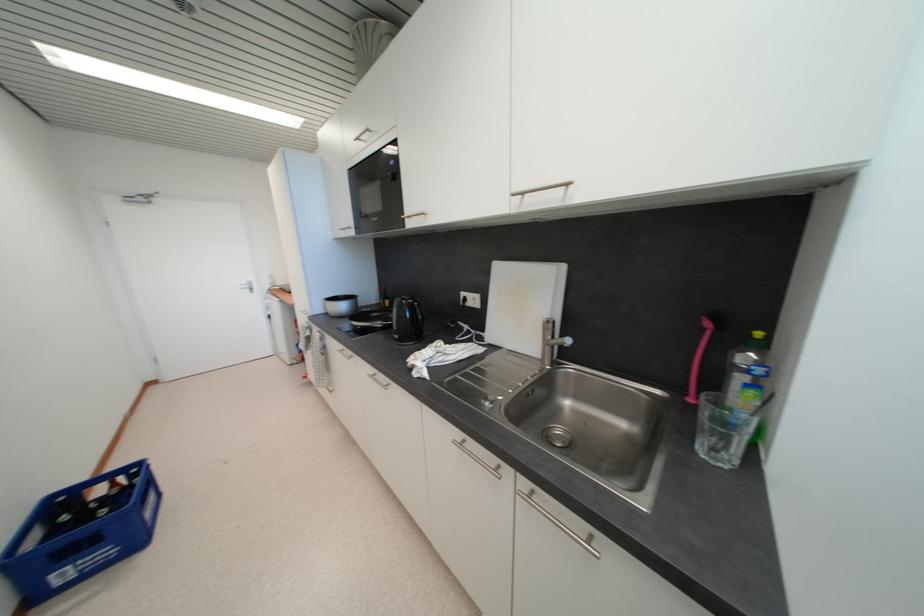
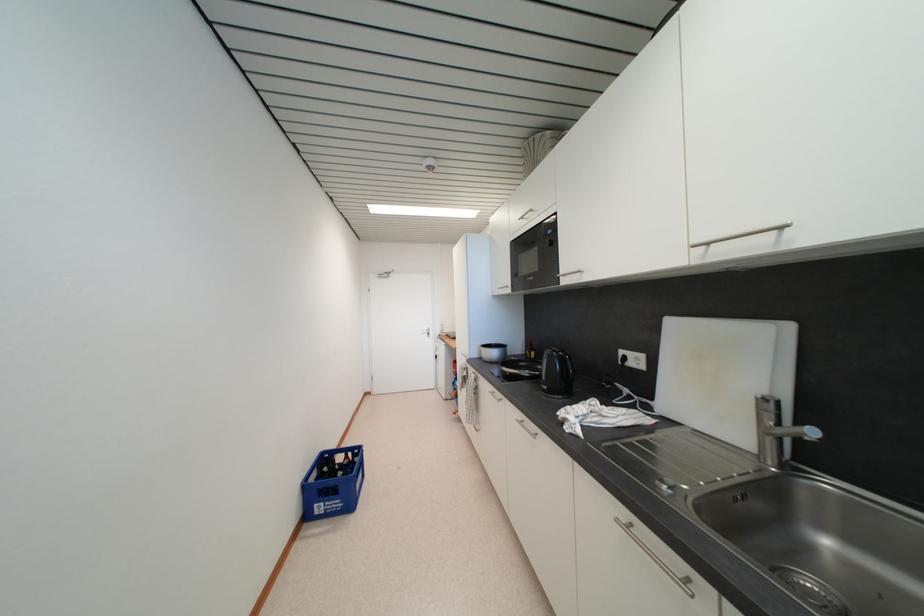
Question: How did the camera likely rotate?

Choices:
 (A) Left
 (B) Right
 (C) Up
 (D) Down

Answer: (A)